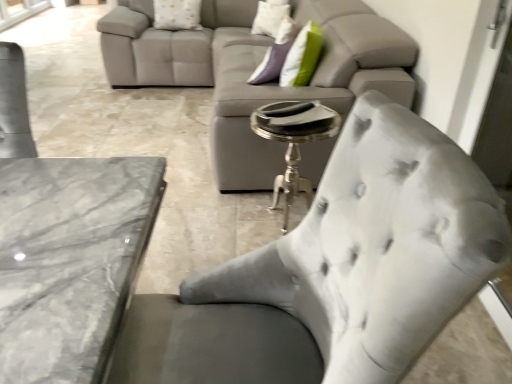
You are a GUI agent. You are given a task and a screenshot of the screen. Output one action in this format:
    pyautogui.click(x=<x>, y=<y>)
    Task: Click on the free space above silver metallic side table at center (from a real-world perspective)
    Image resolution: width=512 pixels, height=384 pixels.
    Given the screenshot: What is the action you would take?
    pyautogui.click(x=286, y=116)